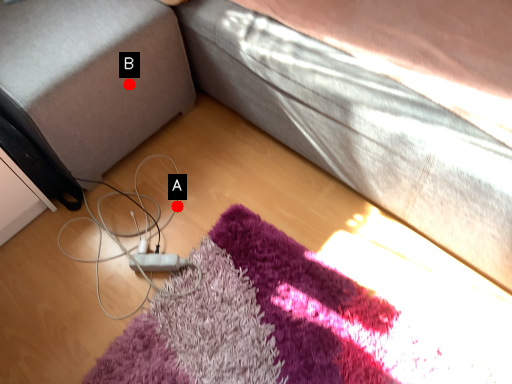
Question: Two points are circled on the image, labeled by A and B beside each circle. Which of the following is the farthest from the observer?

Choices:
 (A) A is further
 (B) B is further

Answer: (A)